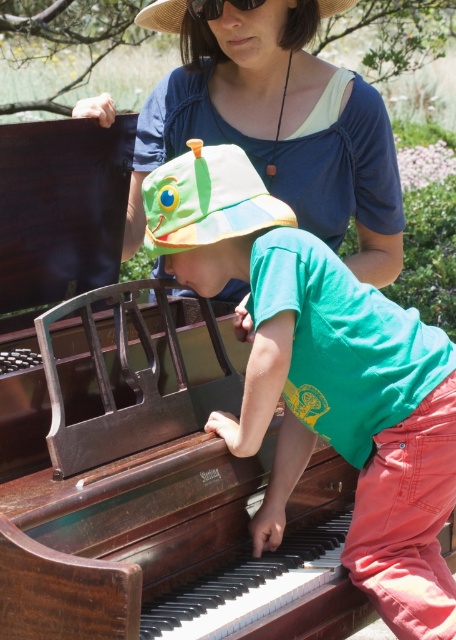
You are standing in front of the piano and want to place a small decoration on one of the two points mentioned. Which point is closer to you, point (398, 608) or point (161, 8)?

Point (398, 608) is closer to the viewer than point (161, 8), so you should place the decoration there.

You are a photographer trying to capture a clear photo of both the green cotton hat at upper center and the black plastic goggles at upper center. The camera you are using has a focus range of 3 feet. Can you take a photo that includes both objects without moving the camera?

The green cotton hat at upper center and the black plastic goggles at upper center are 4.07 feet apart from each other. Since the camera has a focus range of only 3 feet, it cannot capture both objects clearly in the same photo without moving the camera.

You are a photographer setting up a shot of the wooden piano at center and the green cotton hat at upper center. To ensure both are in focus, you need to know their vertical positions. Which object is located higher in the image?

The green cotton hat at upper center is higher in the image than the wooden piano at center, as it is positioned above it.